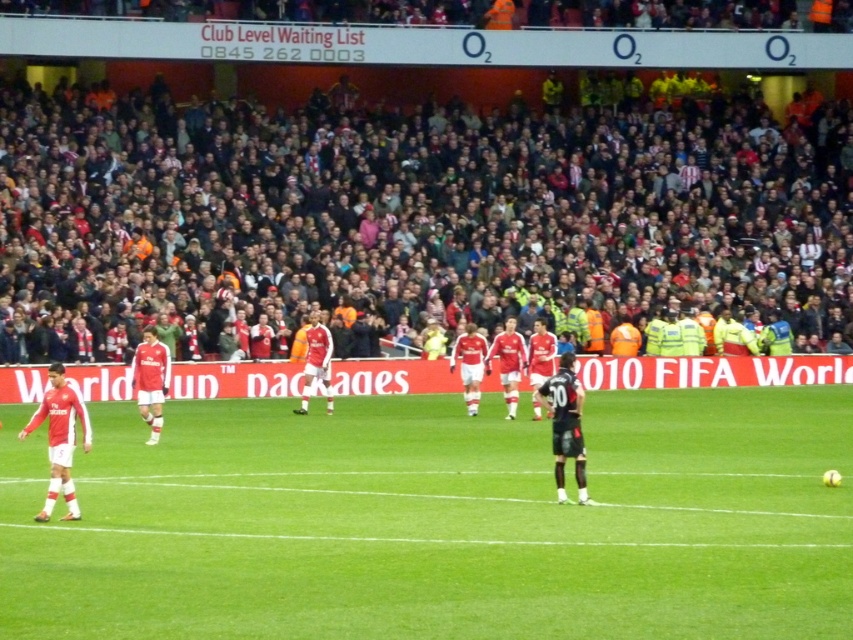
You are a photographer positioned at the camera. You want to capture a closeup shot of the dark red jersey at upper center. Given that your zoom lens can extend up to 100 feet, will you be able to achieve this?

The dark red jersey at upper center is 96.56 feet away from the camera. Since the zoom lens can extend up to 100 feet, you can achieve the closeup shot as the distance is within the lens capability.

Consider the image. You are a drone operator trying to capture aerial footage of the soccer match. The camera is currently positioned at point (440,522). What is the object directly below the camera at this coordinate?

The point (440,522) corresponds to the green grass field at center, so the object directly below the camera is the green grass field at center.

You are a photographer positioned at the edge of the soccer field. You want to take a photo of the dark red jersey at upper center while ensuring the green grass field at center is also visible in the background. Can you position yourself in a way that both are in focus?

The green grass field at center is closer to the viewer than the dark red jersey at upper center. To have both in focus, you need to adjust the camera settings to ensure depth of field covers both distances. However, since the field is closer, focusing on the field might require the jersey to be slightly out of focus unless the aperture is set to a smaller opening for greater depth of field.